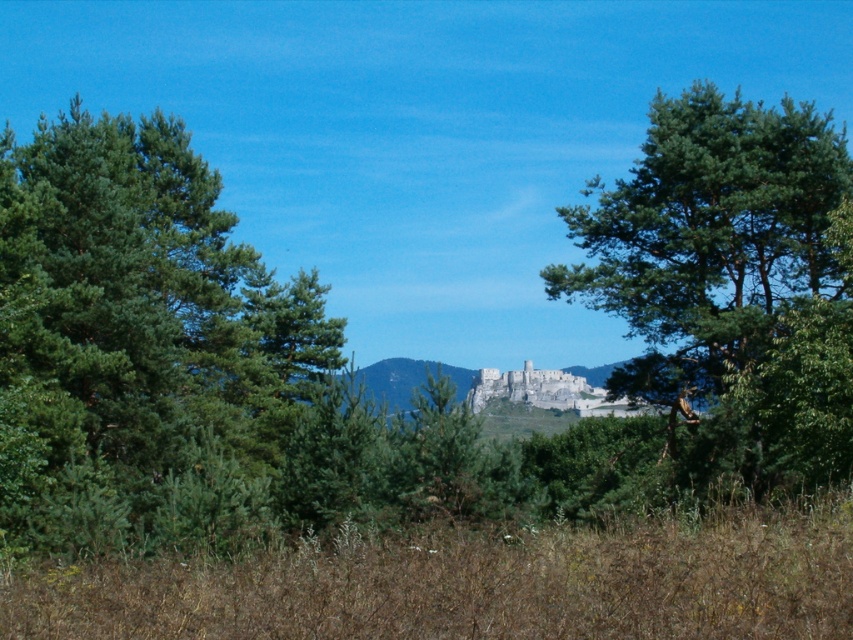
You are standing in the foreground of the landscape scene and want to walk towards the castle in the distance. Which tree should you pass first, the green matte tree at left or the green leafy tree at center?

The green matte tree at left is closer to the viewer than the green leafy tree at center, so you will pass the green matte tree at left first on your way to the castle.

You are a hiker standing in the foreground of the scene. You see the green matte tree at left and the green leafy tree at center. Which tree is closer to the ground?

The green leafy tree at center is closer to the ground because the green matte tree at left is located above it.